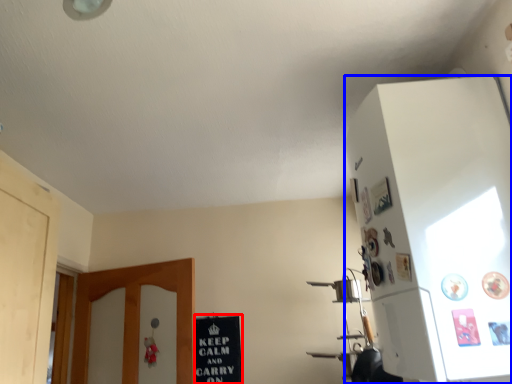
Question: Which of the following is the farthest to the observer, bulletin board (highlighted by a red box) or cabinetry (highlighted by a blue box)?

Choices:
 (A) bulletin board
 (B) cabinetry

Answer: (A)